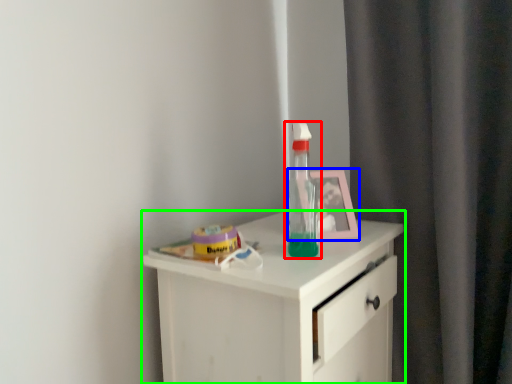
Question: Based on their relative distances, which object is nearer to bottle (highlighted by a red box)? Choose from picture frame (highlighted by a blue box) and chest of drawers (highlighted by a green box).

Choices:
 (A) picture frame
 (B) chest of drawers

Answer: (A)